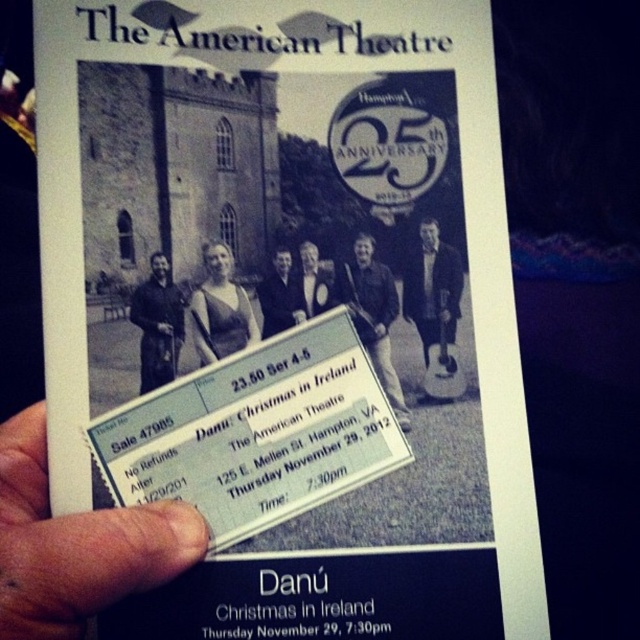
Can you confirm if black leather jacket at center is smaller than matte black dress at center?

No.

Is black leather jacket at center thinner than matte black dress at center?

Indeed, black leather jacket at center has a lesser width compared to matte black dress at center.

I want to click on black leather jacket at center, so click(435, 308).

Which is below, flesh-toned skin at lower left or matte black guitar at center?

flesh-toned skin at lower left is lower down.

Can you confirm if flesh-toned skin at lower left is smaller than matte black guitar at center?

No, flesh-toned skin at lower left is not smaller than matte black guitar at center.

This screenshot has width=640, height=640. Describe the element at coordinates (76, 544) in the screenshot. I see `flesh-toned skin at lower left` at that location.

Identify the location of flesh-toned skin at lower left. (76, 544).

Is the position of matte black guitar at center less distant than that of dark blue suit at center?

No, matte black guitar at center is behind dark blue suit at center.

Is matte black guitar at center shorter than dark blue suit at center?

No, matte black guitar at center is not shorter than dark blue suit at center.

Image resolution: width=640 pixels, height=640 pixels. Describe the element at coordinates (372, 314) in the screenshot. I see `matte black guitar at center` at that location.

Image resolution: width=640 pixels, height=640 pixels. In order to click on matte black guitar at center in this screenshot , I will do `click(372, 314)`.